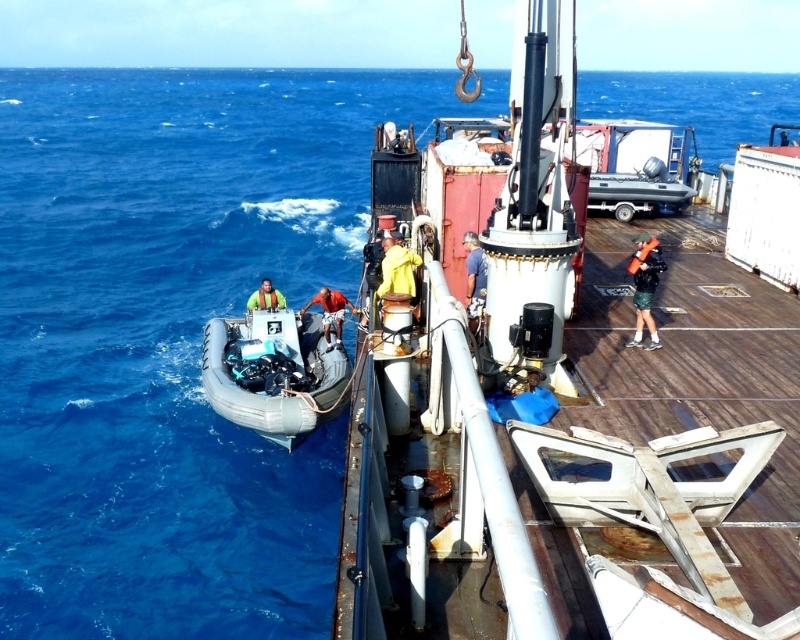
In the scene shown: You are a diver preparing to jump from the inflatable boat to the larger vessel. You see two points in the water marked as point (462, 237) and point (268, 289). Which point should you aim for if you want to reach the deck faster?

Point (462, 237) is closer to the viewer than point (268, 289), so you should aim for point (462, 237) to reach the deck faster.